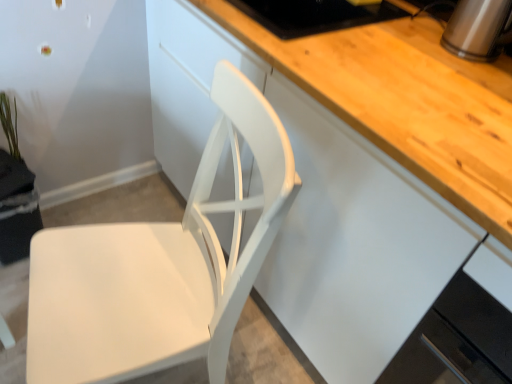
Identify the location of free space underneath satin silver kettle at upper right (from a real-world perspective). (470, 53).